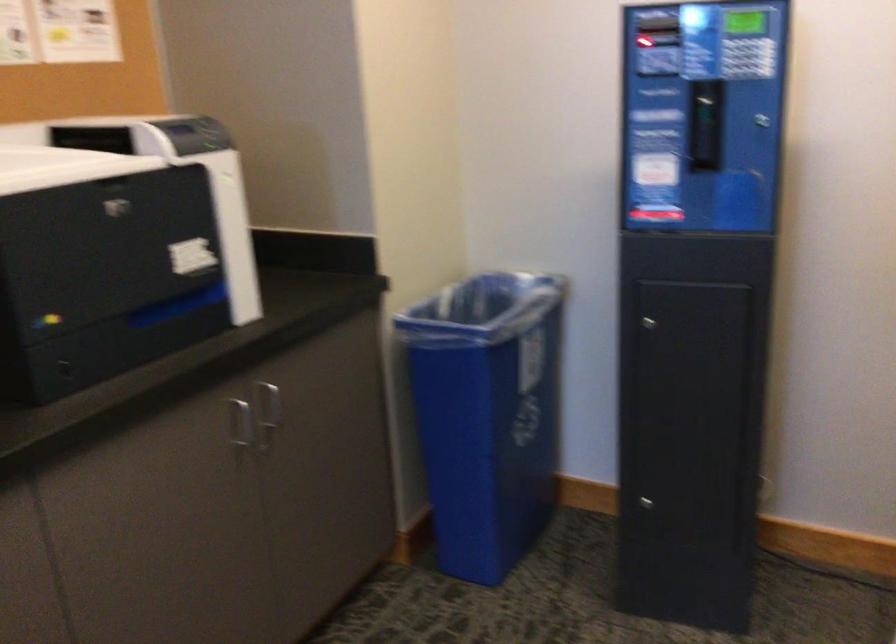
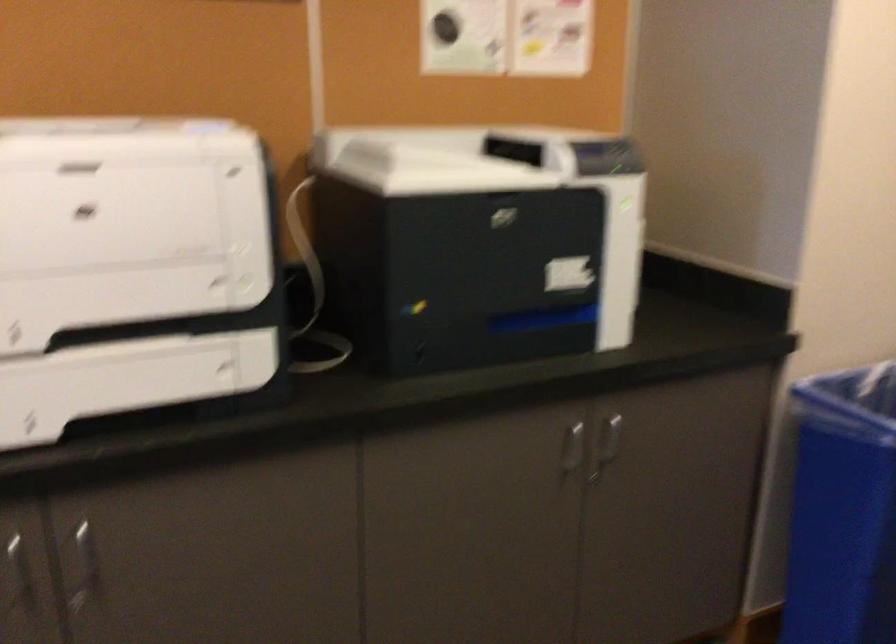
Question: The images are taken continuously from a first-person perspective. In which direction is your viewpoint rotating?

Choices:
 (A) Left
 (B) Right
 (C) Up
 (D) Down

Answer: (A)